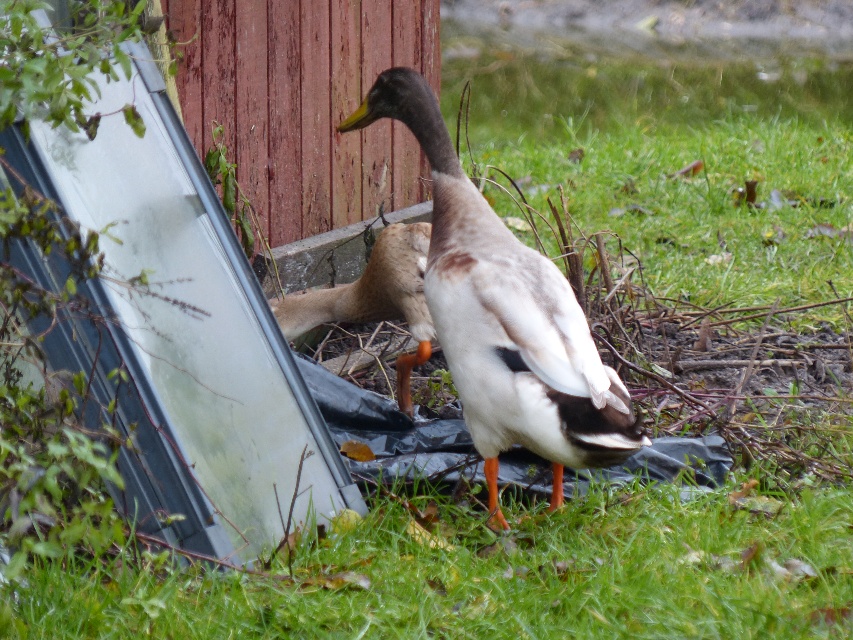
You are standing in the scene and want to pick up an object located at point (x=560, y=336). If your maximum reach is 10 feet, can you reach it without moving?

The point (x=560, y=336) is 12.29 feet from the camera, which is beyond your 10 feet reach. You cannot reach it without moving.

You are a gardener who wants to place a new plant pot between the two ducks. The white matte duck at center is on top of the brown feathered duck at center. Can you place the pot between them without disturbing either duck?

The white matte duck at center is positioned over brown feathered duck at center, so there is no space between them. You cannot place the pot between them without disturbing either duck.

You are a photographer trying to capture both the white matte duck at center and the brown feathered duck at center in a single frame. The camera you have can only focus on objects within a 3 feet range. Will you be able to include both ducks in your photo without moving the camera?

The white matte duck at center and brown feathered duck at center are 3.40 feet apart. Since the camera can only focus within a 3 feet range, the distance between them exceeds this limit, so you cannot capture both ducks in a single frame without moving the camera.